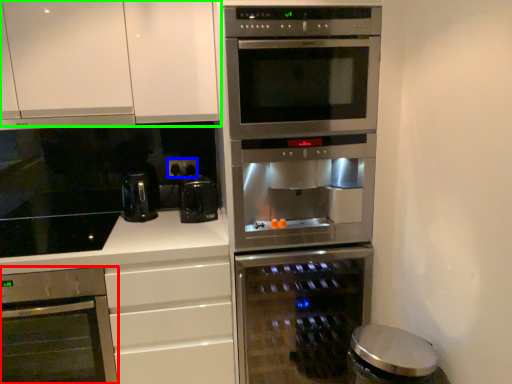
Question: Considering the real-world distances, which object is farthest from oven (highlighted by a red box)? electric outlet (highlighted by a blue box) or cabinetry (highlighted by a green box)?

Choices:
 (A) electric outlet
 (B) cabinetry

Answer: (A)